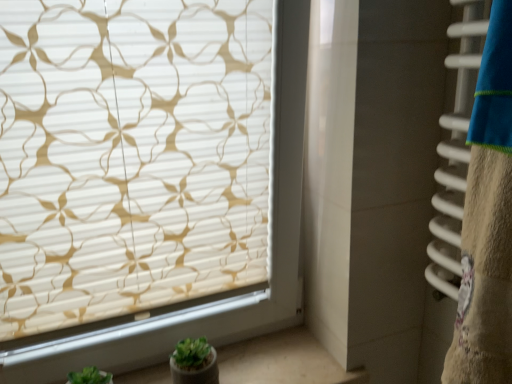
Question: From a real-world perspective, is white smooth window sill at lower left on top of white textured blind at upper left?

Choices:
 (A) yes
 (B) no

Answer: (B)

Question: Is white smooth window sill at lower left oriented away from white textured blind at upper left?

Choices:
 (A) no
 (B) yes

Answer: (A)

Question: Does white smooth window sill at lower left have a larger size compared to white textured blind at upper left?

Choices:
 (A) yes
 (B) no

Answer: (B)

Question: From the image's perspective, does white smooth window sill at lower left appear higher than white textured blind at upper left?

Choices:
 (A) no
 (B) yes

Answer: (A)

Question: Is white textured blind at upper left inside white smooth window sill at lower left?

Choices:
 (A) no
 (B) yes

Answer: (A)

Question: Are white smooth window sill at lower left and white textured blind at upper left beside each other?

Choices:
 (A) no
 (B) yes

Answer: (A)

Question: Considering the relative sizes of white textured blind at upper left and white smooth window sill at lower left in the image provided, is white textured blind at upper left shorter than white smooth window sill at lower left?

Choices:
 (A) yes
 (B) no

Answer: (B)

Question: Would you say white textured blind at upper left is a long distance from white smooth window sill at lower left?

Choices:
 (A) yes
 (B) no

Answer: (B)

Question: Does white textured blind at upper left have a greater width compared to white smooth window sill at lower left?

Choices:
 (A) yes
 (B) no

Answer: (B)

Question: Is white textured blind at upper left facing away from white smooth window sill at lower left?

Choices:
 (A) no
 (B) yes

Answer: (A)

Question: Is white textured blind at upper left thinner than white smooth window sill at lower left?

Choices:
 (A) yes
 (B) no

Answer: (A)

Question: Is white textured blind at upper left taller than white smooth window sill at lower left?

Choices:
 (A) yes
 (B) no

Answer: (A)

Question: In terms of size, does white smooth window sill at lower left appear bigger or smaller than white textured blind at upper left?

Choices:
 (A) small
 (B) big

Answer: (A)